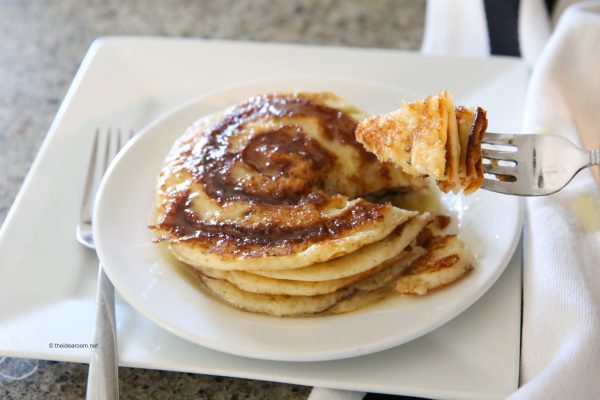
Locate an element on the screen. The width and height of the screenshot is (600, 400). fork is located at coordinates (558, 161), (83, 233).